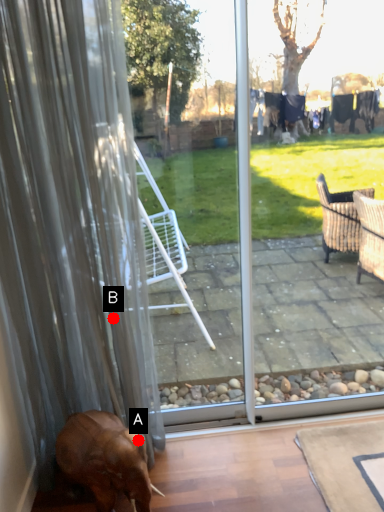
Question: Two points are circled on the image, labeled by A and B beside each circle. Which point is closer to the camera?

Choices:
 (A) A is closer
 (B) B is closer

Answer: (A)